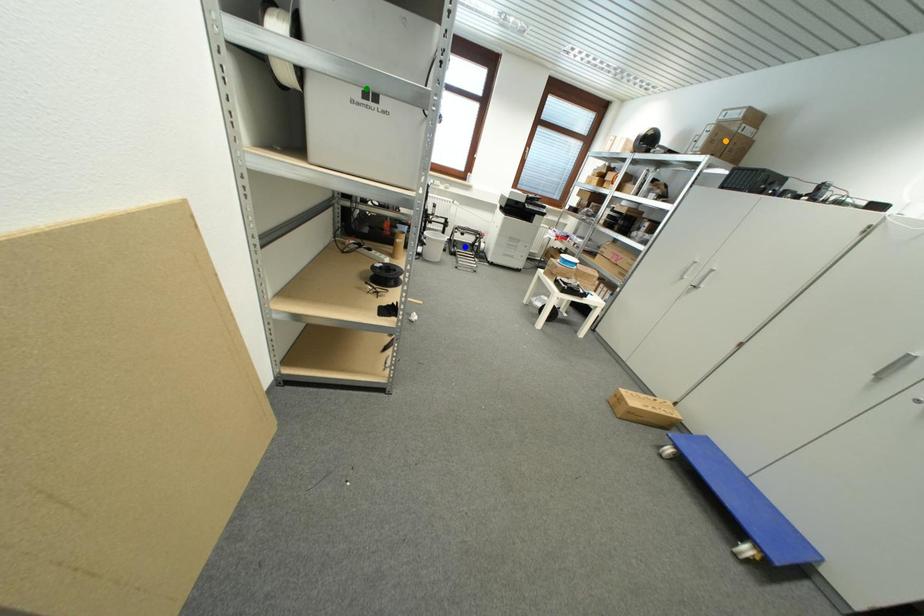
Order these from nearest to farthest:
orange point | green point | blue point

green point, orange point, blue point